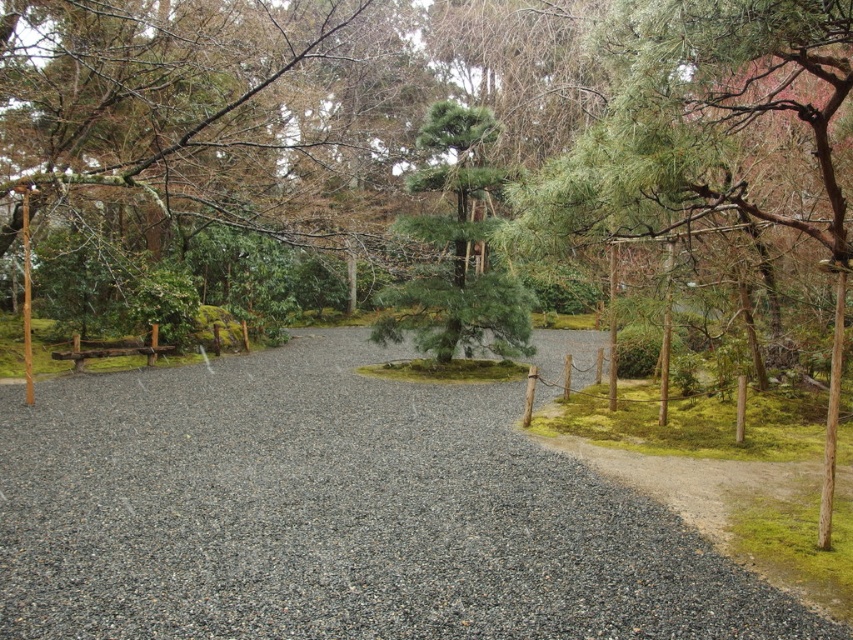
Question: Which point is closer to the camera?

Choices:
 (A) (222, 632)
 (B) (485, 134)
 (C) (688, 8)

Answer: (C)

Question: Which of the following is the closest to the observer?

Choices:
 (A) green needle-like at center
 (B) green needle-like at upper right

Answer: (B)

Question: Does gray gravel at center lie behind green needle-like at upper right?

Choices:
 (A) yes
 (B) no

Answer: (A)

Question: Is green needle-like at upper right positioned behind green needle-like at center?

Choices:
 (A) no
 (B) yes

Answer: (A)

Question: Which object is closer to the camera taking this photo?

Choices:
 (A) green needle-like at upper right
 (B) gray gravel at center

Answer: (A)

Question: Is gray gravel at center above green needle-like at center?

Choices:
 (A) no
 (B) yes

Answer: (A)